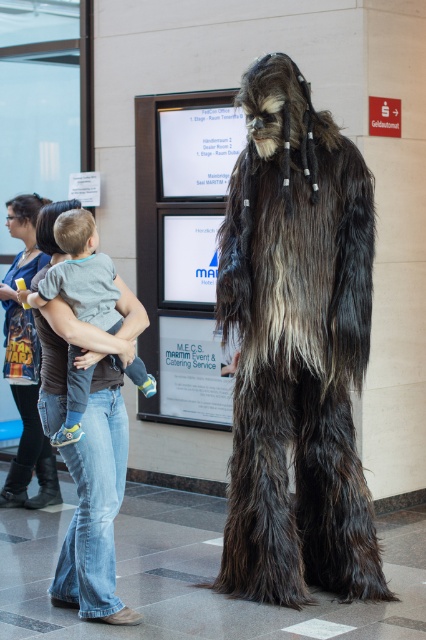
Question: Is fuzzy brown costume at center smaller than gray cotton shirt at center?

Choices:
 (A) no
 (B) yes

Answer: (A)

Question: Which of the following is the farthest from the observer?

Choices:
 (A) fuzzy brown costume at center
 (B) gray cotton shirt at center

Answer: (A)

Question: Does fuzzy brown costume at center appear over gray cotton shirt at center?

Choices:
 (A) no
 (B) yes

Answer: (A)

Question: Is fuzzy brown costume at center to the left of gray cotton shirt at center from the viewer's perspective?

Choices:
 (A) yes
 (B) no

Answer: (B)

Question: Which point is closer to the camera taking this photo?

Choices:
 (A) 273,461
 (B) 112,308

Answer: (B)